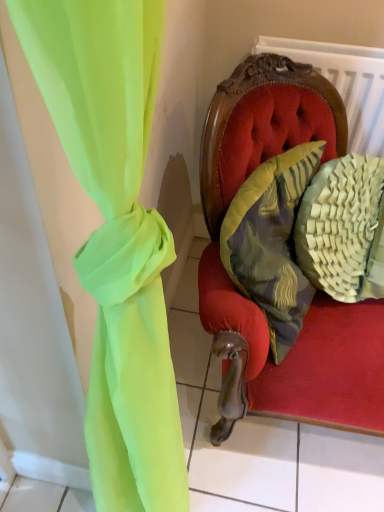
Question: From the image's perspective, is woven beige pillow at right, which appears as the 1th pillow when viewed from the right, located beneath textured yellow pillow at center, the first pillow positioned from the left?

Choices:
 (A) yes
 (B) no

Answer: (B)

Question: From a real-world perspective, is woven beige pillow at right, which appears as the 1th pillow when viewed from the right, on top of textured yellow pillow at center, placed as the 2th pillow when sorted from right to left?

Choices:
 (A) no
 (B) yes

Answer: (A)

Question: Is woven beige pillow at right, placed as the second pillow when sorted from left to right, taller than textured yellow pillow at center, placed as the 2th pillow when sorted from right to left?

Choices:
 (A) yes
 (B) no

Answer: (A)

Question: Could you tell me if woven beige pillow at right, which appears as the 1th pillow when viewed from the right, is facing textured yellow pillow at center, the first pillow positioned from the left?

Choices:
 (A) no
 (B) yes

Answer: (A)

Question: Is the surface of woven beige pillow at right, placed as the second pillow when sorted from left to right, in direct contact with textured yellow pillow at center, placed as the 2th pillow when sorted from right to left?

Choices:
 (A) yes
 (B) no

Answer: (B)

Question: Is woven beige pillow at right, which appears as the 1th pillow when viewed from the right, to the left of textured yellow pillow at center, placed as the 2th pillow when sorted from right to left, from the viewer's perspective?

Choices:
 (A) no
 (B) yes

Answer: (A)

Question: From the image's perspective, is textured yellow pillow at center, the first pillow positioned from the left, under woven beige pillow at right, placed as the second pillow when sorted from left to right?

Choices:
 (A) yes
 (B) no

Answer: (A)

Question: Is textured yellow pillow at center, placed as the 2th pillow when sorted from right to left, oriented away from woven beige pillow at right, which appears as the 1th pillow when viewed from the right?

Choices:
 (A) no
 (B) yes

Answer: (A)

Question: Is textured yellow pillow at center, placed as the 2th pillow when sorted from right to left, at the right side of woven beige pillow at right, which appears as the 1th pillow when viewed from the right?

Choices:
 (A) no
 (B) yes

Answer: (A)

Question: Considering the relative sizes of textured yellow pillow at center, the first pillow positioned from the left, and woven beige pillow at right, which appears as the 1th pillow when viewed from the right, in the image provided, is textured yellow pillow at center, the first pillow positioned from the left, thinner than woven beige pillow at right, which appears as the 1th pillow when viewed from the right,?

Choices:
 (A) no
 (B) yes

Answer: (B)

Question: Is textured yellow pillow at center, the first pillow positioned from the left, placed right next to woven beige pillow at right, placed as the second pillow when sorted from left to right?

Choices:
 (A) no
 (B) yes

Answer: (A)

Question: Considering the relative sizes of textured yellow pillow at center, the first pillow positioned from the left, and woven beige pillow at right, placed as the second pillow when sorted from left to right, in the image provided, is textured yellow pillow at center, the first pillow positioned from the left, smaller than woven beige pillow at right, placed as the second pillow when sorted from left to right,?

Choices:
 (A) no
 (B) yes

Answer: (A)

Question: From a real-world perspective, is woven beige pillow at right, placed as the second pillow when sorted from left to right, above or below textured yellow pillow at center, placed as the 2th pillow when sorted from right to left?

Choices:
 (A) below
 (B) above

Answer: (A)